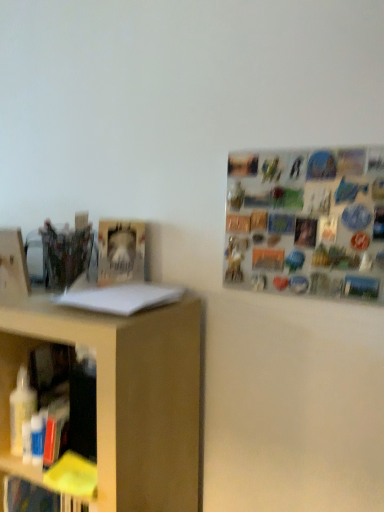
Question: Is the surface of white paper at left, the first book in the bottom-to-top sequence, in direct contact with metallic silver magnets at upper right?

Choices:
 (A) yes
 (B) no

Answer: (B)

Question: Is white paper at left, the first book in the bottom-to-top sequence, turned away from metallic silver magnets at upper right?

Choices:
 (A) yes
 (B) no

Answer: (B)

Question: Considering the relative sizes of white paper at left, arranged as the 1th book when viewed from the front, and metallic silver magnets at upper right in the image provided, is white paper at left, arranged as the 1th book when viewed from the front, smaller than metallic silver magnets at upper right?

Choices:
 (A) yes
 (B) no

Answer: (A)

Question: Would you consider white paper at left, which is counted as the 2th book, starting from the back, to be distant from metallic silver magnets at upper right?

Choices:
 (A) no
 (B) yes

Answer: (A)

Question: Does white paper at left, the first book in the bottom-to-top sequence, have a greater height compared to metallic silver magnets at upper right?

Choices:
 (A) yes
 (B) no

Answer: (B)

Question: From a real-world perspective, is white paper at left, arranged as the 1th book when viewed from the front, under metallic silver magnets at upper right?

Choices:
 (A) yes
 (B) no

Answer: (A)

Question: Would you consider metallic silver magnets at upper right to be distant from white paper at left, which is counted as the 2th book, starting from the back?

Choices:
 (A) yes
 (B) no

Answer: (B)

Question: Can you confirm if metallic silver magnets at upper right is taller than white paper at left, the 2th book viewed from the top?

Choices:
 (A) no
 (B) yes

Answer: (B)

Question: Can you confirm if metallic silver magnets at upper right is thinner than white paper at left, arranged as the 1th book when viewed from the front?

Choices:
 (A) no
 (B) yes

Answer: (B)

Question: From the image's perspective, would you say metallic silver magnets at upper right is shown under white paper at left, arranged as the 1th book when viewed from the front?

Choices:
 (A) no
 (B) yes

Answer: (A)

Question: Can you confirm if metallic silver magnets at upper right is positioned to the right of white paper at left, the 2th book viewed from the top?

Choices:
 (A) yes
 (B) no

Answer: (A)

Question: Is white paper at left, arranged as the 1th book when viewed from the front, surrounded by metallic silver magnets at upper right?

Choices:
 (A) no
 (B) yes

Answer: (A)

Question: Is hardcover book at center-left, arranged as the second book when viewed from the front, located within white paper at left, the first book in the bottom-to-top sequence?

Choices:
 (A) no
 (B) yes

Answer: (A)